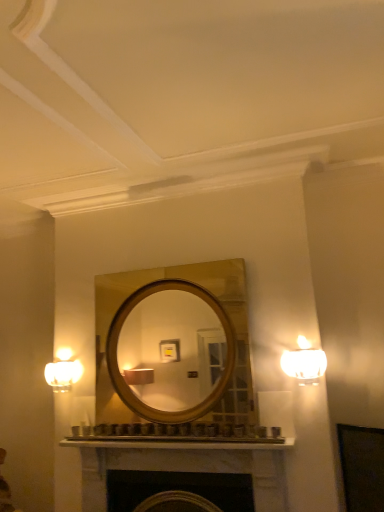
Question: Can you confirm if matte white sconce at left is wider than white marble fireplace at lower center?

Choices:
 (A) yes
 (B) no

Answer: (B)

Question: Considering the relative positions of matte white sconce at left and white marble fireplace at lower center in the image provided, is matte white sconce at left in front of white marble fireplace at lower center?

Choices:
 (A) yes
 (B) no

Answer: (B)

Question: Does matte white sconce at left have a greater height compared to white marble fireplace at lower center?

Choices:
 (A) yes
 (B) no

Answer: (B)

Question: Can you confirm if matte white sconce at left is thinner than white marble fireplace at lower center?

Choices:
 (A) yes
 (B) no

Answer: (A)

Question: Considering the relative positions of matte white sconce at left and white marble fireplace at lower center in the image provided, is matte white sconce at left to the right of white marble fireplace at lower center from the viewer's perspective?

Choices:
 (A) yes
 (B) no

Answer: (B)

Question: Is white marble fireplace at lower center at the back of matte white sconce at left?

Choices:
 (A) yes
 (B) no

Answer: (B)

Question: Is white frosted glass lamp at right turned away from white marble fireplace at lower center?

Choices:
 (A) no
 (B) yes

Answer: (A)

Question: Does white frosted glass lamp at right have a greater height compared to white marble fireplace at lower center?

Choices:
 (A) no
 (B) yes

Answer: (A)

Question: From a real-world perspective, is white frosted glass lamp at right positioned under white marble fireplace at lower center based on gravity?

Choices:
 (A) no
 (B) yes

Answer: (A)

Question: Can you confirm if white frosted glass lamp at right is smaller than white marble fireplace at lower center?

Choices:
 (A) yes
 (B) no

Answer: (A)

Question: Does white frosted glass lamp at right turn towards white marble fireplace at lower center?

Choices:
 (A) no
 (B) yes

Answer: (A)

Question: Does white frosted glass lamp at right have a larger size compared to white marble fireplace at lower center?

Choices:
 (A) yes
 (B) no

Answer: (B)

Question: Would you say matte white sconce at left is a long distance from white frosted glass lamp at right?

Choices:
 (A) no
 (B) yes

Answer: (B)